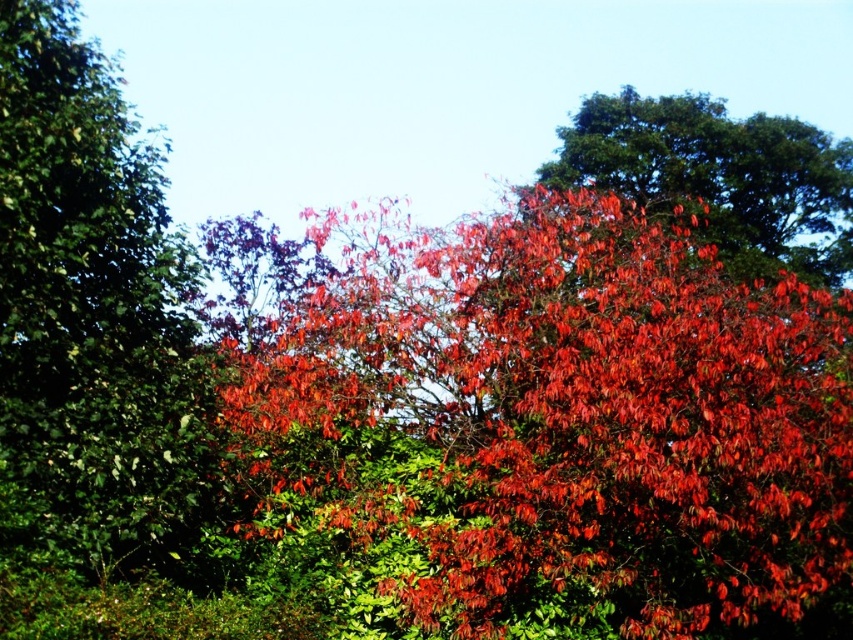
Find the location of a particular element. This screenshot has width=853, height=640. green matte leaves at left is located at coordinates (86, 307).

Does point (20, 160) come farther from viewer compared to point (757, 241)?

No, it is in front of (757, 241).

The width and height of the screenshot is (853, 640). I want to click on green matte leaves at left, so click(86, 307).